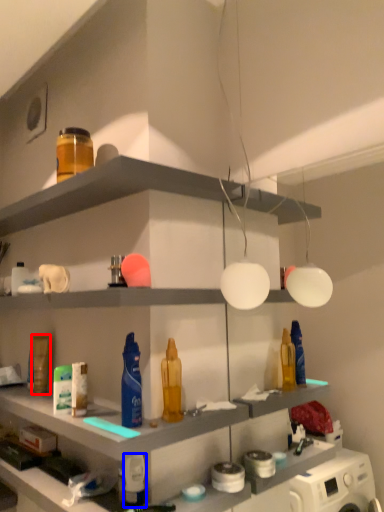
Question: Which point is further to the camera, toiletry (highlighted by a red box) or toiletry (highlighted by a blue box)?

Choices:
 (A) toiletry
 (B) toiletry

Answer: (A)